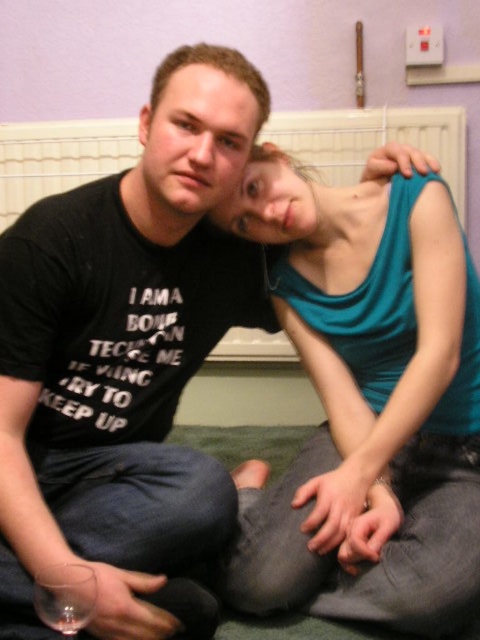
You are an interior designer planning to install a new heating system in the room. The teal fabric tank top at upper right and the white plastic radiator at upper center are in the way. Which object should you move first to access the radiator?

The teal fabric tank top at upper right should be moved first because it is positioned under the white plastic radiator at upper center, meaning the radiator is above it and likely requires clearance from below to access.